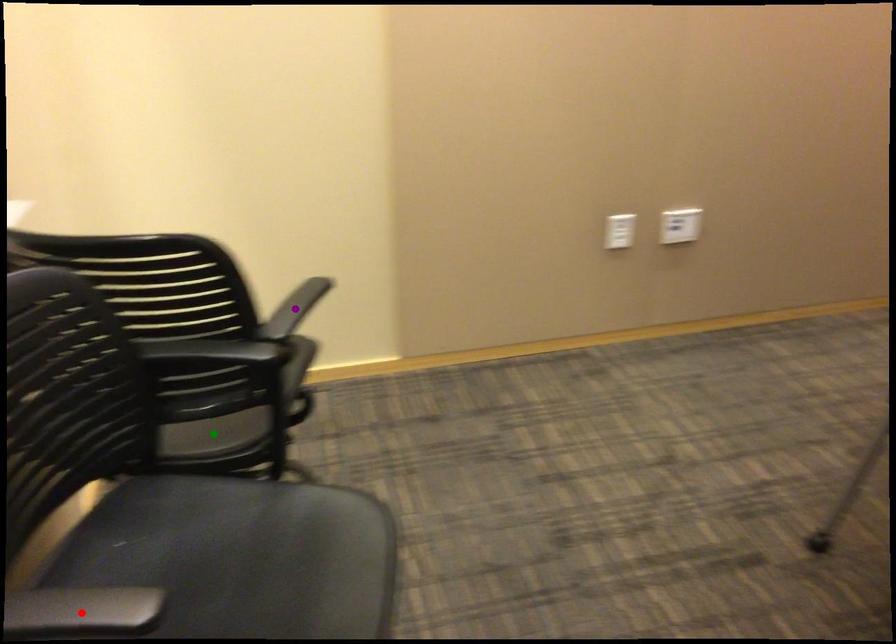
From the picture: Order these from nearest to farthest:
red point, purple point, green point

red point < purple point < green point